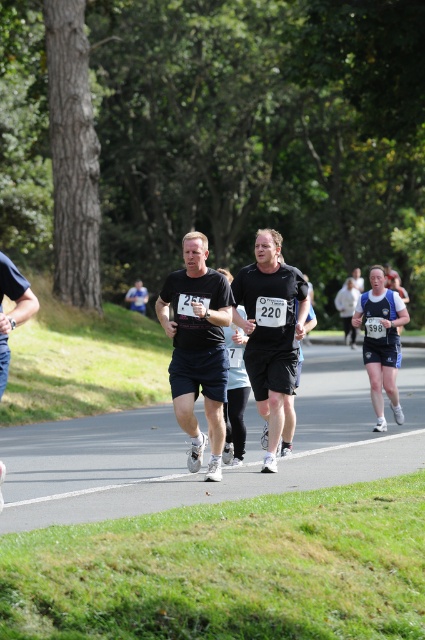
You are a photographer positioned on the side of the road during a marathon. You notice the blue fabric shorts at right and the blue fabric shirt at center. Which item is positioned lower in the image?

The blue fabric shorts at right is below the blue fabric shirt at center, so the blue fabric shorts at right is positioned lower in the image.

You are a photographer positioned at the starting line of the marathon. You want to capture a photo of the blue fabric shorts at right and the blue fabric shirt at center. Which object should you zoom in on to ensure it takes up more space in your photo?

The blue fabric shorts at right might be wider than blue fabric shirt at center, so you should zoom in on the blue fabric shorts at right to ensure it takes up more space in your photo.